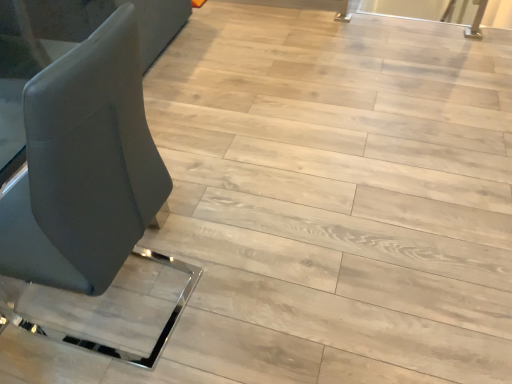
This screenshot has height=384, width=512. Find the location of `vacant space to the right of matte gray chair at left`. vacant space to the right of matte gray chair at left is located at coordinates (247, 282).